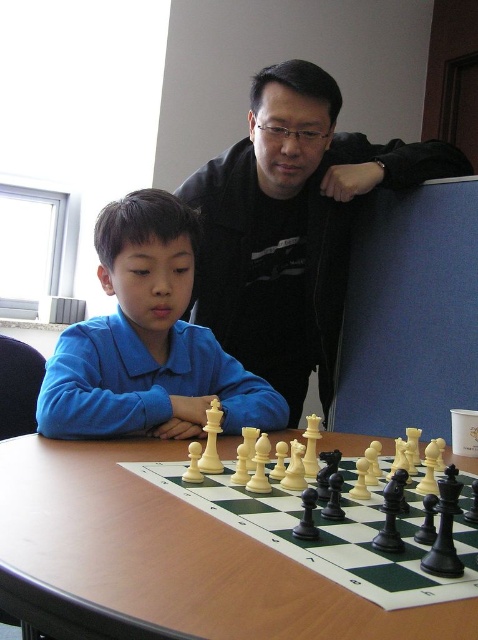
Is black matte jacket at upper center to the left of blue cotton shirt at center from the viewer's perspective?

No, black matte jacket at upper center is not to the left of blue cotton shirt at center.

Which is more to the left, black matte jacket at upper center or blue cotton shirt at center?

Positioned to the left is blue cotton shirt at center.

Describe the element at coordinates (292, 227) in the screenshot. The height and width of the screenshot is (640, 478). I see `black matte jacket at upper center` at that location.

The height and width of the screenshot is (640, 478). I want to click on black matte jacket at upper center, so click(292, 227).

Describe the element at coordinates (163, 561) in the screenshot. I see `wooden table at center` at that location.

What do you see at coordinates (163, 561) in the screenshot? I see `wooden table at center` at bounding box center [163, 561].

The width and height of the screenshot is (478, 640). In order to click on wooden table at center in this screenshot , I will do `click(163, 561)`.

What do you see at coordinates (163, 561) in the screenshot? I see `wooden table at center` at bounding box center [163, 561].

Where is `wooden table at center`? wooden table at center is located at coordinates click(x=163, y=561).

Is point (19, 476) less distant than point (302, 67)?

Yes, point (19, 476) is in front of point (302, 67).

Image resolution: width=478 pixels, height=640 pixels. I want to click on wooden table at center, so click(163, 561).